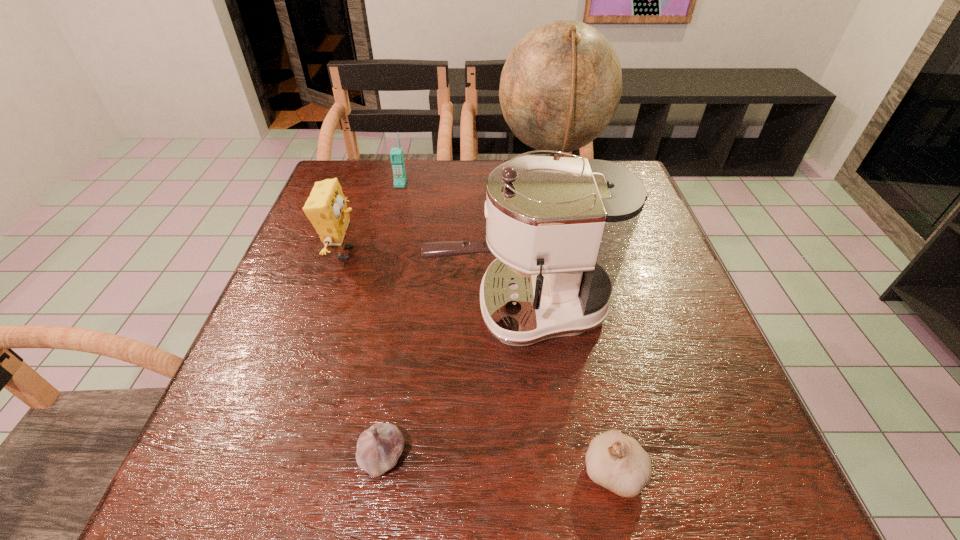
I want to click on blank area located on the front-facing side of the coffee maker, so click(x=348, y=309).

Locate an element on the screen. free region located on the front-facing side of the coffee maker is located at coordinates (328, 309).

At what (x,y) coordinates should I click in order to perform the action: click on blank area located on the face of the leftmost object. Please return your answer as a coordinate pair (x, y). The image size is (960, 540). Looking at the image, I should click on (450, 253).

Locate an element on the screen. vacant area situated 0.290m on the keypad of the second object from left to right is located at coordinates (384, 255).

At what (x,y) coordinates should I click in order to perform the action: click on free space located 0.230m on the right of the third object from left to right. Please return your answer as a coordinate pair (x, y). Looking at the image, I should click on (550, 456).

The height and width of the screenshot is (540, 960). I want to click on vacant region located on the right of the right garlic, so click(x=735, y=470).

Locate an element on the screen. The height and width of the screenshot is (540, 960). globe positioned at the far edge is located at coordinates (560, 87).

Where is `cellular telephone situated at the far edge`? This screenshot has height=540, width=960. cellular telephone situated at the far edge is located at coordinates (396, 155).

Where is `object present at the left edge`? Image resolution: width=960 pixels, height=540 pixels. object present at the left edge is located at coordinates (326, 208).

Identify the location of object present at the right edge. (560, 87).